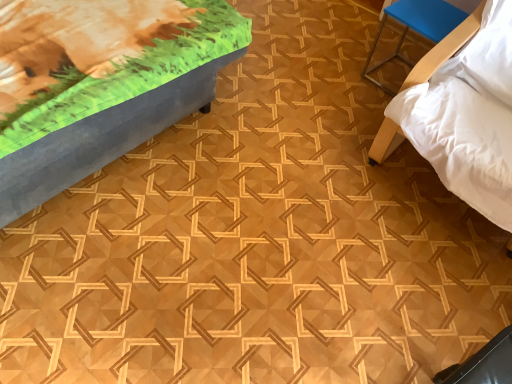
Locate an element on the screen. vacant region above blue plastic stool at upper right, marked as the second furniture in a left-to-right arrangement (from a real-world perspective) is located at coordinates (438, 14).